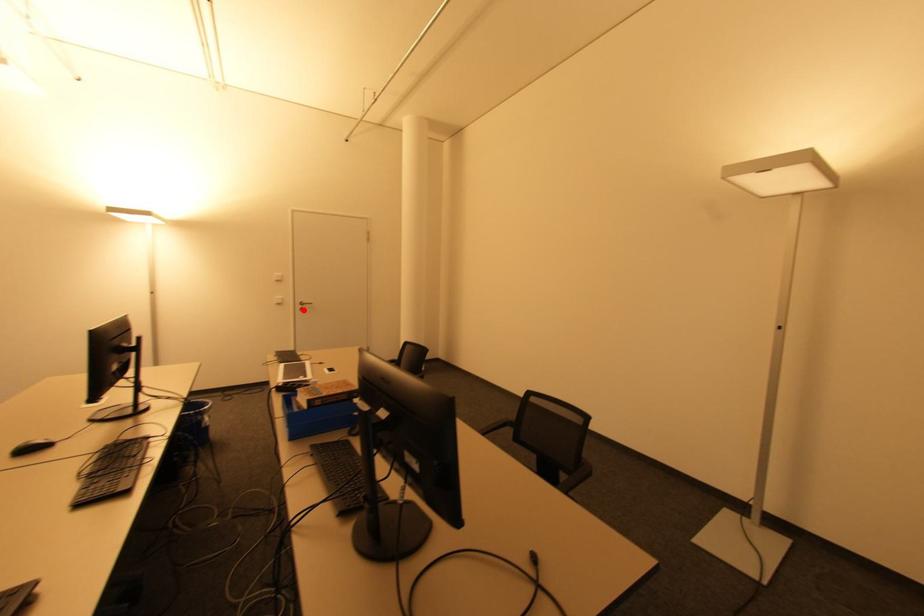
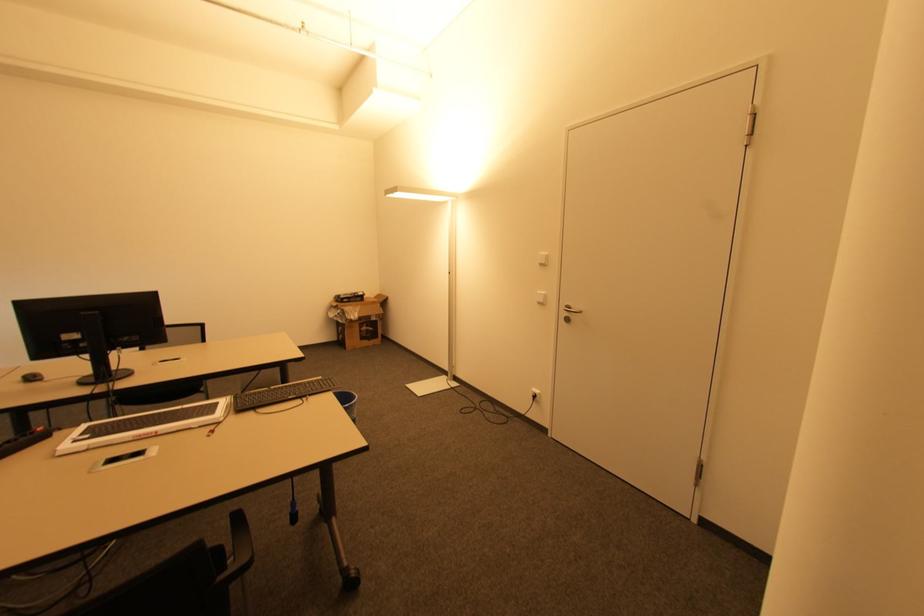
Where in the second image is the point corresponding to the highlighted location from the first image?

(568, 320)